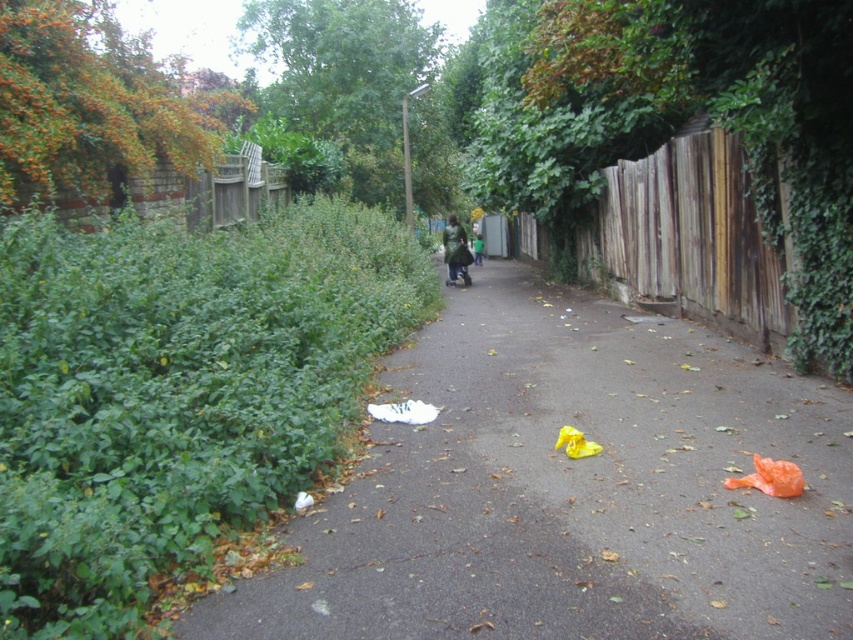
Question: From the image, what is the correct spatial relationship of white paper at center in relation to wooden fence at right?

Choices:
 (A) below
 (B) above

Answer: (A)

Question: Which object appears closest to the camera in this image?

Choices:
 (A) white paper at center
 (B) dark green coat at center
 (C) wooden fence at right

Answer: (A)

Question: Which object is the closest to the white paper at center?

Choices:
 (A) dark green coat at center
 (B) wooden fence at right

Answer: (B)

Question: Can you confirm if white paper at center is smaller than wooden fence at right?

Choices:
 (A) yes
 (B) no

Answer: (A)

Question: Which point is closer to the camera?

Choices:
 (A) white paper at center
 (B) dark green coat at center
 (C) green matte jacket at center

Answer: (A)

Question: Does white paper at center come in front of wooden fence at right?

Choices:
 (A) yes
 (B) no

Answer: (A)